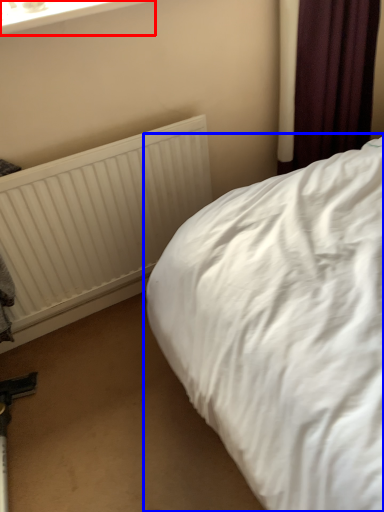
Question: Which object is closer to the camera taking this photo, window frame (highlighted by a red box) or bed (highlighted by a blue box)?

Choices:
 (A) window frame
 (B) bed

Answer: (B)